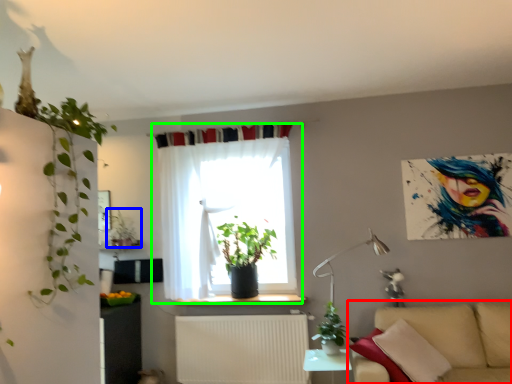
Question: Based on their relative distances, which object is farther from studio couch (highlighted by a red box)? Choose from houseplant (highlighted by a blue box) and curtain (highlighted by a green box).

Choices:
 (A) houseplant
 (B) curtain

Answer: (A)